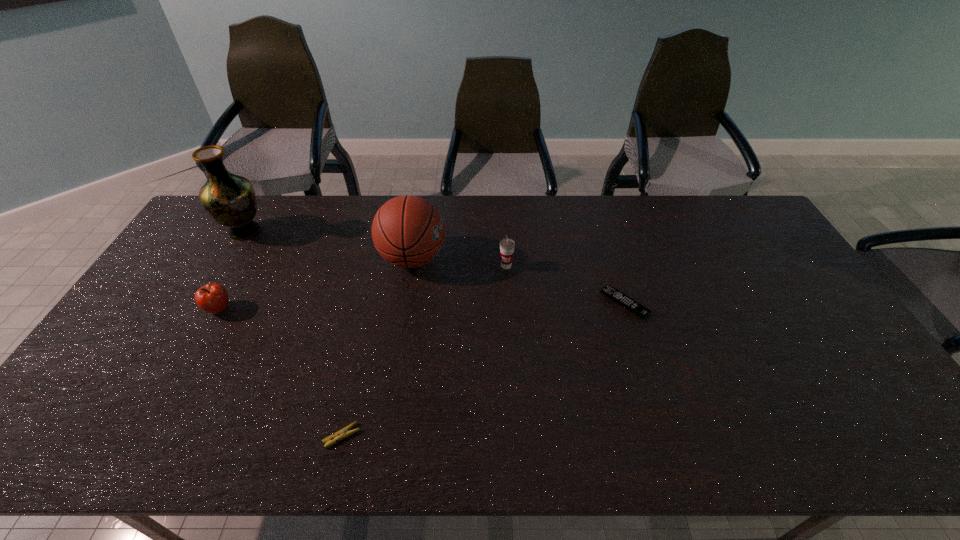
You are a GUI agent. You are given a task and a screenshot of the screen. Output one action in this format:
    pyautogui.click(x=<x>, y=<y>)
    Task: Click on the free space located on the right of the apple
    
    Given the screenshot: What is the action you would take?
    pyautogui.click(x=281, y=309)

Locate an element on the screen. This screenshot has width=960, height=540. free region located 0.340m on the right of the remote control is located at coordinates (761, 303).

Locate an element on the screen. free space located on the left of the nearest object is located at coordinates (216, 436).

In order to click on vase situated at the far edge in this screenshot , I will do `click(230, 199)`.

You are a GUI agent. You are given a task and a screenshot of the screen. Output one action in this format:
    pyautogui.click(x=<x>, y=<y>)
    Task: Click on the basketball located in the far edge section of the desktop
    This screenshot has width=960, height=540.
    Given the screenshot: What is the action you would take?
    pyautogui.click(x=408, y=231)

At what (x,y) coordinates should I click in order to perform the action: click on object at the near edge. Please return your answer as a coordinate pair (x, y). Image resolution: width=960 pixels, height=540 pixels. Looking at the image, I should click on (343, 433).

You are a GUI agent. You are given a task and a screenshot of the screen. Output one action in this format:
    pyautogui.click(x=<x>, y=<y>)
    Task: Click on the object at the left edge
    The image size is (960, 540).
    Given the screenshot: What is the action you would take?
    pyautogui.click(x=230, y=199)

Locate an element on the screen. This screenshot has height=540, width=960. object that is at the far left corner is located at coordinates click(230, 199).

Where is `vacant space at the far edge`? The width and height of the screenshot is (960, 540). vacant space at the far edge is located at coordinates (486, 218).

In the image, there is a desktop. Where is `free region at the near edge`? free region at the near edge is located at coordinates (807, 431).